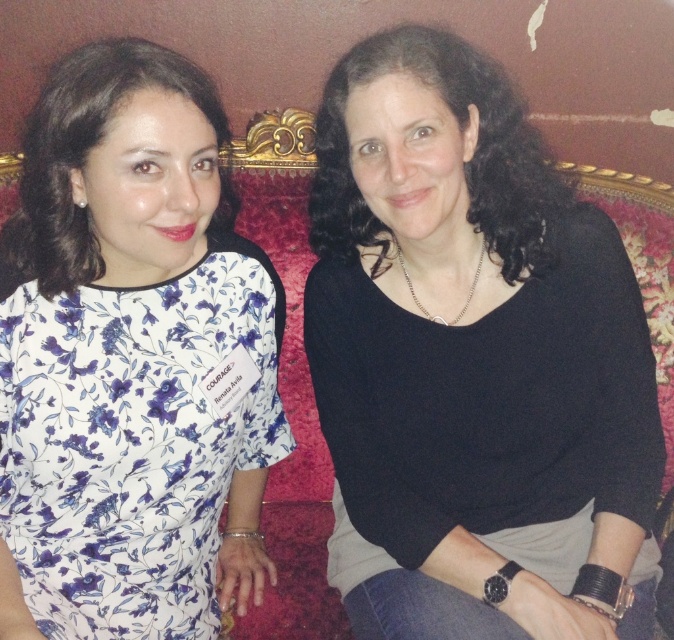
Between black matte sweater at center and floral print fabric dress at left, which one is positioned lower?

Positioned lower is floral print fabric dress at left.

The image size is (674, 640). What do you see at coordinates (472, 362) in the screenshot? I see `black matte sweater at center` at bounding box center [472, 362].

This screenshot has height=640, width=674. Find the location of `black matte sweater at center`. black matte sweater at center is located at coordinates (472, 362).